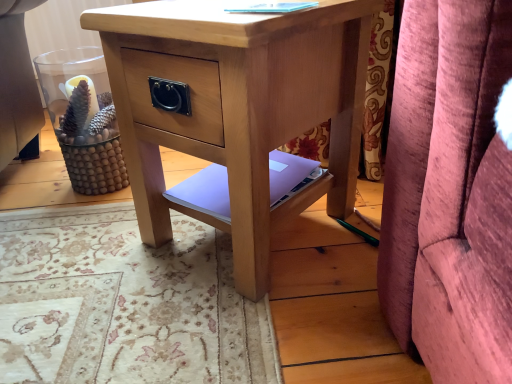
Describe the element at coordinates (238, 108) in the screenshot. I see `natural wood nightstand at center` at that location.

You are a GUI agent. You are given a task and a screenshot of the screen. Output one action in this format:
    pyautogui.click(x=<x>, y=<y>)
    Task: Click on the natural wood nightstand at center
    
    Given the screenshot: What is the action you would take?
    pyautogui.click(x=238, y=108)

I want to click on natural wood nightstand at center, so (x=238, y=108).